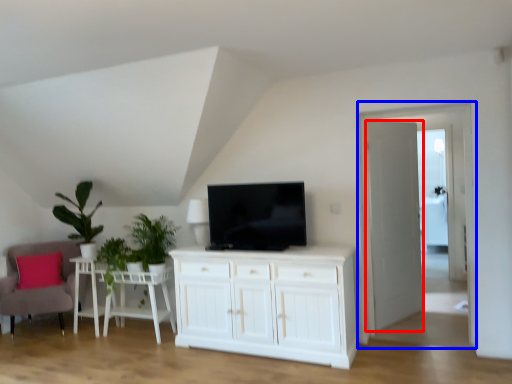
Question: Which object is closer to the camera taking this photo, door (highlighted by a red box) or glass door (highlighted by a blue box)?

Choices:
 (A) door
 (B) glass door

Answer: (B)